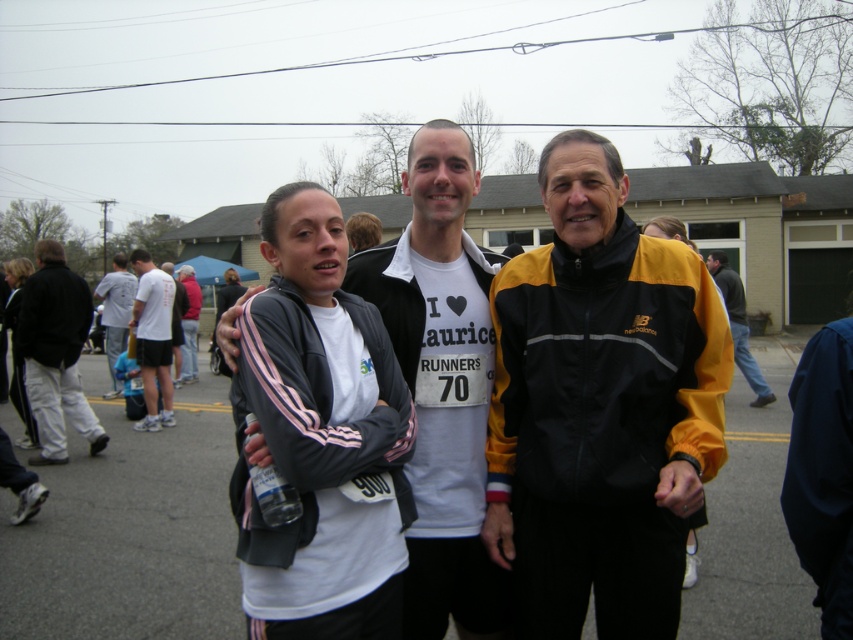
Question: Considering the real-world distances, which object is closest to the yellow/black jacket at center?

Choices:
 (A) yellow/black new balance jacket at center
 (B) white t-shirt at left
 (C) white t-shirt at center
 (D) red fabric shirt at center

Answer: (B)

Question: Considering the relative positions of yellow/black new balance jacket at center and red fabric shirt at center in the image provided, where is yellow/black new balance jacket at center located with respect to red fabric shirt at center?

Choices:
 (A) below
 (B) above

Answer: (A)

Question: Does white t-shirt at left have a larger size compared to white t-shirt at center?

Choices:
 (A) yes
 (B) no

Answer: (B)

Question: Which object is positioned farthest from the red fabric shirt at center?

Choices:
 (A) yellow/black jacket at center
 (B) white t-shirt at center
 (C) white cotton t-shirt at center
 (D) yellow/black new balance jacket at center

Answer: (C)

Question: Does white cotton t-shirt at center have a lesser width compared to black cotton pants at left?

Choices:
 (A) yes
 (B) no

Answer: (A)

Question: Which point is farther from the camera taking this photo?

Choices:
 (A) coord(172,416)
 (B) coord(177,275)

Answer: (B)